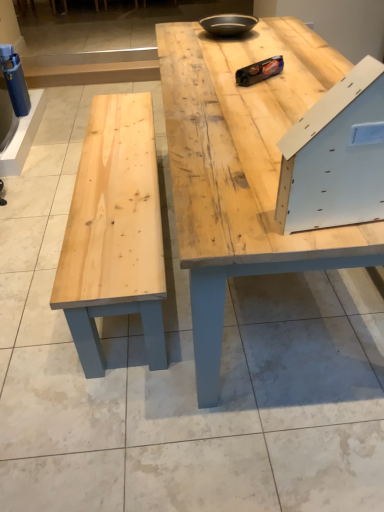
The height and width of the screenshot is (512, 384). What are the coordinates of `natural wood table at center` in the screenshot? It's located at (242, 168).

Describe the element at coordinates (242, 168) in the screenshot. The image size is (384, 512). I see `natural wood table at center` at that location.

You are a GUI agent. You are given a task and a screenshot of the screen. Output one action in this format:
    pyautogui.click(x=<x>, y=<y>)
    Task: Click on the natural wood table at center
    The image size is (384, 512).
    Given the screenshot: What is the action you would take?
    pyautogui.click(x=242, y=168)

Based on the photo, between natural wood table at center and white matte drawer at upper right, which one has smaller size?

white matte drawer at upper right is smaller.

Is natural wood table at center closer to the viewer compared to white matte drawer at upper right?

No, natural wood table at center is behind white matte drawer at upper right.

From the image's perspective, is natural wood table at center above or below white matte drawer at upper right?

Based on their image positions, natural wood table at center is located above white matte drawer at upper right.

Locate an element on the screen. The image size is (384, 512). table that is behind the white matte drawer at upper right is located at coordinates (242, 168).

From the image's perspective, would you say matte black bowl at upper center is shown under natural wood table at center?

No.

Is matte black bowl at upper center to the left or to the right of natural wood table at center in the image?

Based on their positions, matte black bowl at upper center is located to the left of natural wood table at center.

Considering the relative sizes of matte black bowl at upper center and natural wood table at center in the image provided, is matte black bowl at upper center bigger than natural wood table at center?

No, matte black bowl at upper center is not bigger than natural wood table at center.

From the image's perspective, does matte black bowl at upper center appear lower than white matte drawer at upper right?

No, from the image's perspective, matte black bowl at upper center is not below white matte drawer at upper right.

Does matte black bowl at upper center turn towards white matte drawer at upper right?

Yes, matte black bowl at upper center is oriented towards white matte drawer at upper right.

Who is taller, matte black bowl at upper center or white matte drawer at upper right?

white matte drawer at upper right.

Looking at their sizes, would you say white matte drawer at upper right is wider or thinner than matte black bowl at upper center?

Considering their sizes, white matte drawer at upper right looks slimmer than matte black bowl at upper center.

Where is `drawer that is in front of the matte black bowl at upper center`? drawer that is in front of the matte black bowl at upper center is located at coordinates (336, 156).

Is white matte drawer at upper right to the left of matte black bowl at upper center from the viewer's perspective?

In fact, white matte drawer at upper right is to the right of matte black bowl at upper center.

Between white matte drawer at upper right and matte black bowl at upper center, which one is positioned in front?

white matte drawer at upper right is in front.

From the image's perspective, which one is positioned higher, white matte drawer at upper right or natural wood table at center?

From the image's view, natural wood table at center is above.

Between white matte drawer at upper right and natural wood table at center, which one is positioned behind?

natural wood table at center is further from the camera.

Is white matte drawer at upper right wider or thinner than natural wood table at center?

white matte drawer at upper right is thinner than natural wood table at center.

Who is taller, white matte drawer at upper right or natural wood table at center?

With more height is natural wood table at center.

Would you say natural wood table at center is outside matte black bowl at upper center?

That's correct, natural wood table at center is outside of matte black bowl at upper center.

Can you confirm if natural wood table at center is smaller than matte black bowl at upper center?

No, natural wood table at center is not smaller than matte black bowl at upper center.

Looking at this image, is natural wood table at center with matte black bowl at upper center?

No, natural wood table at center is not making contact with matte black bowl at upper center.

Consider the image. From the image's perspective, which object appears higher, natural wood table at center or matte black bowl at upper center?

matte black bowl at upper center, from the image's perspective.

Where is `table behind the white matte drawer at upper right`? The width and height of the screenshot is (384, 512). table behind the white matte drawer at upper right is located at coordinates (242, 168).

Where is `table directly beneath the matte black bowl at upper center (from a real-world perspective)`? table directly beneath the matte black bowl at upper center (from a real-world perspective) is located at coordinates (242, 168).

Estimate the real-world distances between objects in this image. Which object is closer to natural wood table at center, white matte drawer at upper right or matte black bowl at upper center?

Based on the image, white matte drawer at upper right appears to be nearer to natural wood table at center.

Consider the image. Which object lies further to the anchor point matte black bowl at upper center, natural wood table at center or white matte drawer at upper right?

white matte drawer at upper right lies further to matte black bowl at upper center than the other object.

When comparing their distances from white matte drawer at upper right, does natural wood table at center or matte black bowl at upper center seem closer?

natural wood table at center lies closer to white matte drawer at upper right than the other object.

Considering their positions, is matte black bowl at upper center positioned further to natural wood table at center than white matte drawer at upper right?

matte black bowl at upper center lies further to natural wood table at center than the other object.

Looking at the image, which one is located closer to white matte drawer at upper right, matte black bowl at upper center or natural wood table at center?

natural wood table at center lies closer to white matte drawer at upper right than the other object.

From the image, which object appears to be farther from matte black bowl at upper center, white matte drawer at upper right or natural wood table at center?

white matte drawer at upper right is further to matte black bowl at upper center.

Image resolution: width=384 pixels, height=512 pixels. Identify the location of table between white matte drawer at upper right and matte black bowl at upper center from front to back. (242, 168).